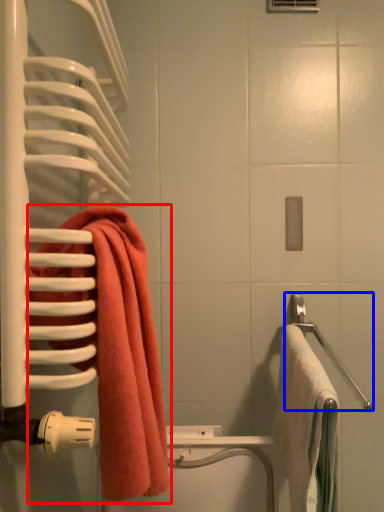
Question: Which of the following is the closest to the observer, towel (highlighted by a red box) or towel bar (highlighted by a blue box)?

Choices:
 (A) towel
 (B) towel bar

Answer: (A)